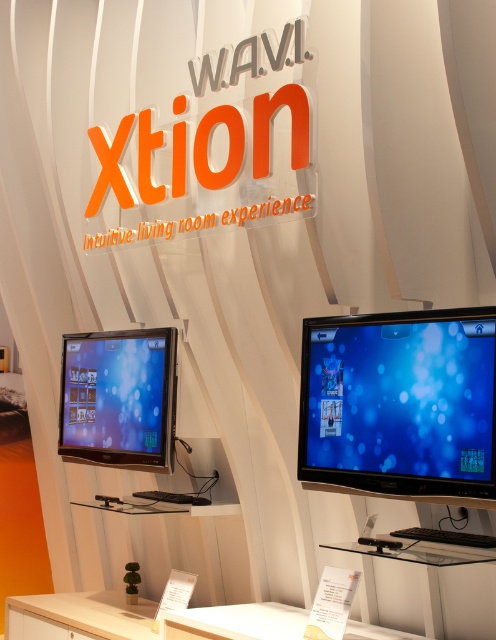
Is glossy black monitor at center bigger than satin black monitor at lower left?

Incorrect, glossy black monitor at center is not larger than satin black monitor at lower left.

Does glossy black monitor at center lie in front of satin black monitor at lower left?

That is True.

Is point (306, 330) less distant than point (120, 429)?

Yes.

This screenshot has width=496, height=640. What are the coordinates of `glossy black monitor at center` in the screenshot? It's located at (399, 403).